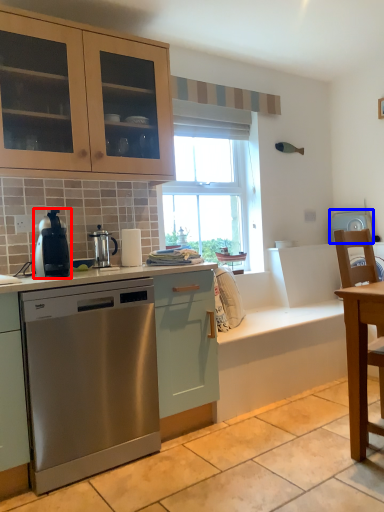
Question: Which of the following is the farthest to the observer, home appliance (highlighted by a red box) or appliance (highlighted by a blue box)?

Choices:
 (A) home appliance
 (B) appliance

Answer: (B)